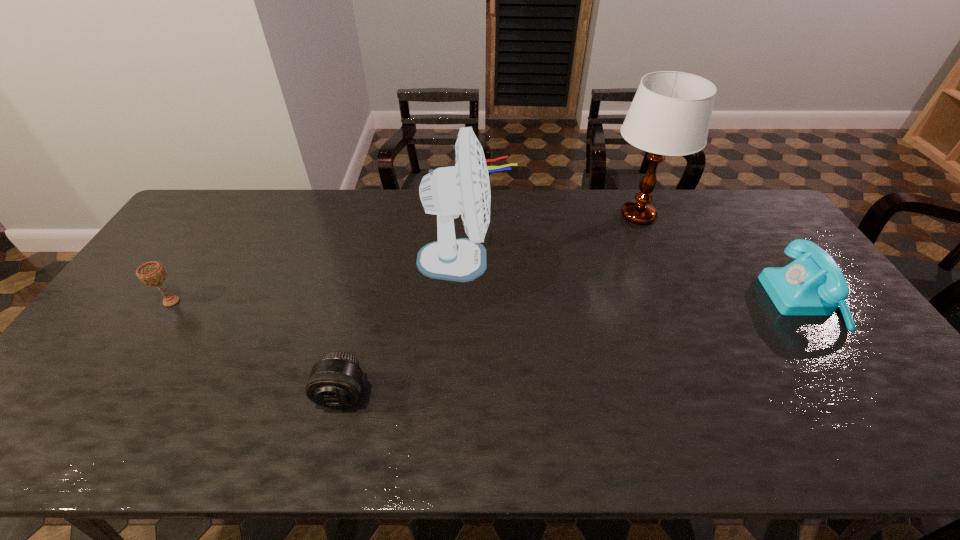
Where is `free region located 0.140m on the dial of the telephone`? This screenshot has width=960, height=540. free region located 0.140m on the dial of the telephone is located at coordinates (723, 301).

The width and height of the screenshot is (960, 540). Find the location of `vacant space located on the front of the chalice`. vacant space located on the front of the chalice is located at coordinates (97, 415).

Find the location of a particular element. Image resolution: width=960 pixels, height=540 pixels. free region located on the front-facing side of the second object from left to right is located at coordinates (332, 434).

Locate an element on the screen. table lamp positioned at the far edge is located at coordinates (670, 114).

The width and height of the screenshot is (960, 540). What are the coordinates of `fan that is at the far edge` in the screenshot? It's located at (447, 192).

I want to click on object at the left edge, so click(x=152, y=273).

Locate an element on the screen. The image size is (960, 540). object present at the right edge is located at coordinates (812, 285).

The height and width of the screenshot is (540, 960). In the image, there is a desktop. In order to click on vacant area at the far edge in this screenshot , I will do `click(323, 201)`.

This screenshot has height=540, width=960. In order to click on vacant space at the near edge in this screenshot , I will do `click(715, 455)`.

The width and height of the screenshot is (960, 540). Find the location of `vacant space at the right edge of the desktop`. vacant space at the right edge of the desktop is located at coordinates (772, 251).